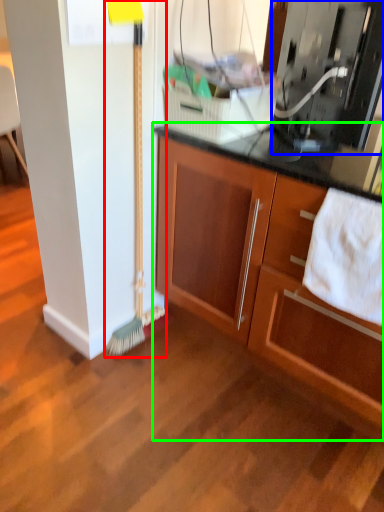
Question: Based on their relative distances, which object is nearer to brush (highlighted by a red box)? Choose from appliance (highlighted by a blue box) and cabinetry (highlighted by a green box).

Choices:
 (A) appliance
 (B) cabinetry

Answer: (B)